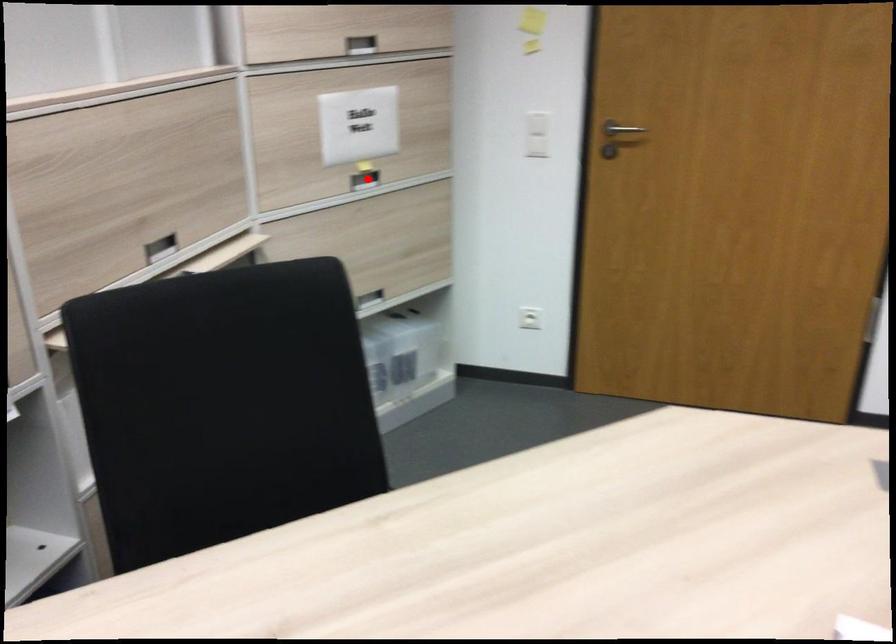
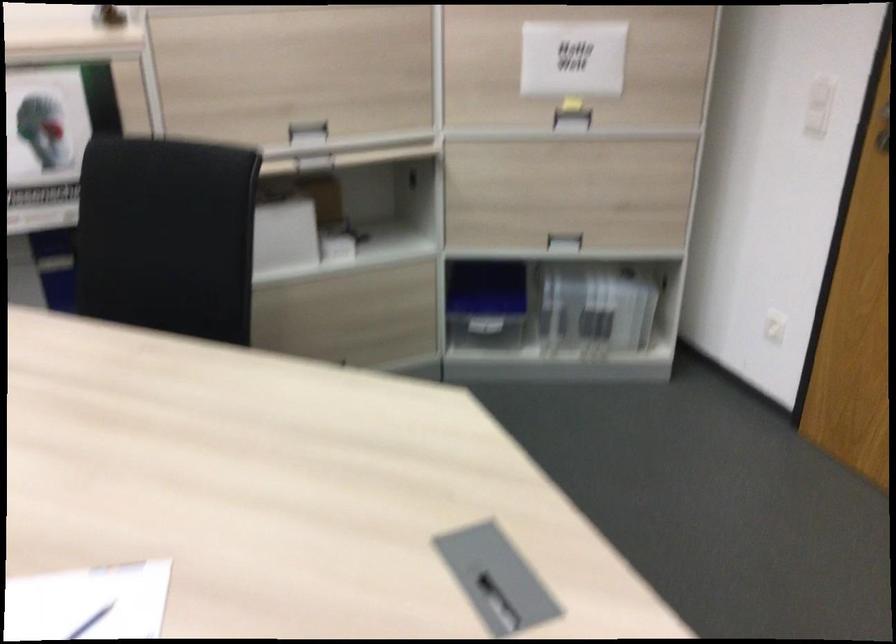
The point at the highlighted location is marked in the first image. Where is the corresponding point in the second image?

(572, 120)